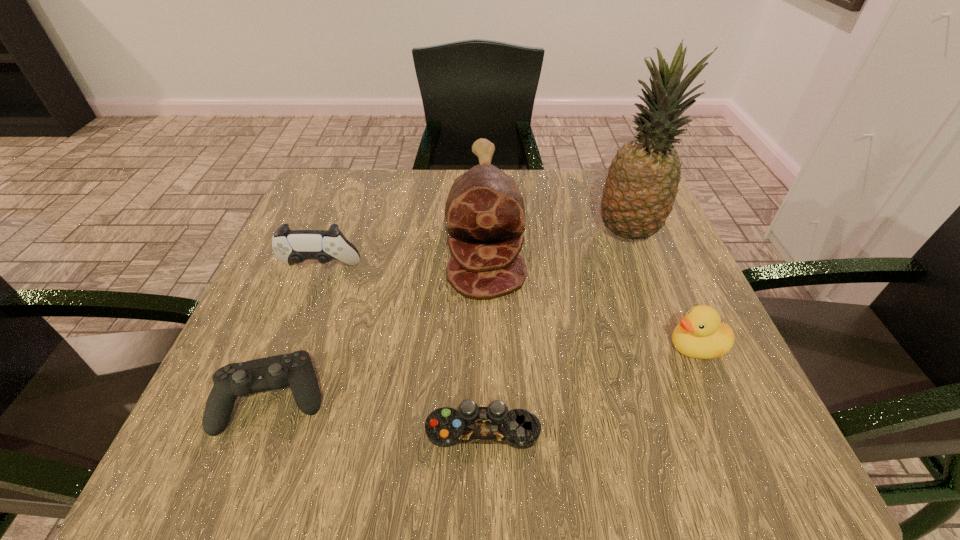
Locate an element on the screen. This screenshot has width=960, height=540. free point between the second shortest control and the pineapple is located at coordinates (450, 315).

At what (x,y) coordinates should I click in order to perform the action: click on empty location between the second shortest object and the shortest object. Please return your answer as a coordinate pair (x, y). The width and height of the screenshot is (960, 540). Looking at the image, I should click on (378, 414).

Where is `unoccupied position between the ham and the second shortest object`? Image resolution: width=960 pixels, height=540 pixels. unoccupied position between the ham and the second shortest object is located at coordinates tap(379, 313).

Where is `free space between the second tallest object and the shortest object`? free space between the second tallest object and the shortest object is located at coordinates (484, 328).

Where is `free spot between the fifth shortest object and the second tallest control`? The image size is (960, 540). free spot between the fifth shortest object and the second tallest control is located at coordinates (379, 313).

Identify the location of empty space that is in between the duckling and the second tallest control. (485, 373).

Where is `object that can be found as the third closest to the tallest control`? This screenshot has height=540, width=960. object that can be found as the third closest to the tallest control is located at coordinates (445, 427).

Locate which object ranks fourth in proximity to the shortest control. Please provide its 2D coordinates. Your answer should be formatted as a tuple, i.e. [(x, y)], where the tuple contains the x and y coordinates of a point satisfying the conditions above.

[(290, 246)]

Identify which control is located as the second nearest to the ham. Please provide its 2D coordinates. Your answer should be formatted as a tuple, i.e. [(x, y)], where the tuple contains the x and y coordinates of a point satisfying the conditions above.

[(295, 370)]

Identify which control is the nearest to the tallest object. Please provide its 2D coordinates. Your answer should be formatted as a tuple, i.e. [(x, y)], where the tuple contains the x and y coordinates of a point satisfying the conditions above.

[(445, 427)]